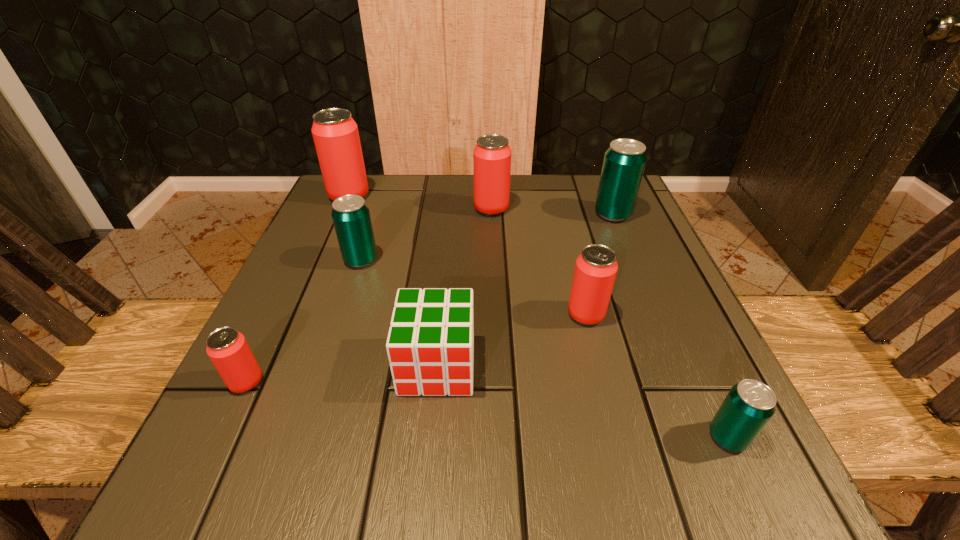
You are a GUI agent. You are given a task and a screenshot of the screen. Output one action in this format:
    pyautogui.click(x=<x>, y=<y>)
    Task: Click on the free spot at the near left corner of the desktop
    The image size is (960, 540).
    Given the screenshot: What is the action you would take?
    click(x=300, y=466)

Where is `free space at the far right corner`? The height and width of the screenshot is (540, 960). free space at the far right corner is located at coordinates (592, 202).

This screenshot has width=960, height=540. Find the location of `vacant space at the near right corner`. vacant space at the near right corner is located at coordinates (661, 471).

The width and height of the screenshot is (960, 540). Identify the location of empty space that is in between the farthest teal beer can and the nearest teal beer can. (670, 326).

At what (x,y) coordinates should I click in order to perform the action: click on vacant point located between the biggest teal beer can and the fourth beer can from left to right. Please return your answer as a coordinate pair (x, y). Looking at the image, I should click on (552, 211).

Where is `blank region between the smallest teal beer can and the fourth beer can from right to left`? The image size is (960, 540). blank region between the smallest teal beer can and the fourth beer can from right to left is located at coordinates (610, 323).

This screenshot has height=540, width=960. I want to click on free space between the third object from right to left and the smallest teal beer can, so click(657, 376).

What are the coordinates of `free spot between the red cube and the nearest beer can` in the screenshot? It's located at (583, 401).

Find the location of a particular element. The width and height of the screenshot is (960, 540). free space between the sixth farthest beer can and the red cube is located at coordinates (342, 374).

Choose which object is the nearest neighbor to the fourth beer can from left to right. Please provide its 2D coordinates. Your answer should be formatted as a tuple, i.e. [(x, y)], where the tuple contains the x and y coordinates of a point satisfying the conditions above.

[(624, 161)]